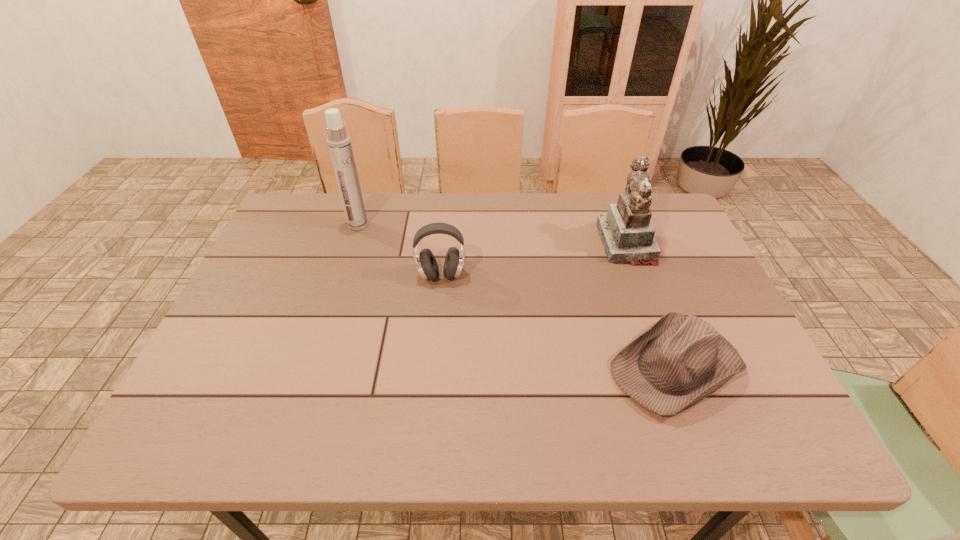
Identify the location of aerosol can. (339, 143).

What are the coordinates of `the leftmost object` in the screenshot? It's located at (339, 143).

Locate an element on the screen. Image resolution: width=960 pixels, height=540 pixels. the third shortest object is located at coordinates (627, 234).

Locate an element on the screen. This screenshot has width=960, height=540. the second object from left to right is located at coordinates (426, 263).

Where is `the third tallest object`? the third tallest object is located at coordinates (426, 263).

Find the location of a particular element. The width and height of the screenshot is (960, 540). the shortest object is located at coordinates pyautogui.click(x=680, y=360).

Image resolution: width=960 pixels, height=540 pixels. What are the coordinates of `the nearest object` in the screenshot? It's located at (680, 360).

Find the location of a particular element. The image size is (960, 540). vacant space located 0.100m on the left of the aerosol can is located at coordinates (315, 225).

Where is `blank space located on the front-facing side of the third shortest object`? This screenshot has width=960, height=540. blank space located on the front-facing side of the third shortest object is located at coordinates (510, 244).

Identify the location of vacant area situated on the front-facing side of the third shortest object. (556, 244).